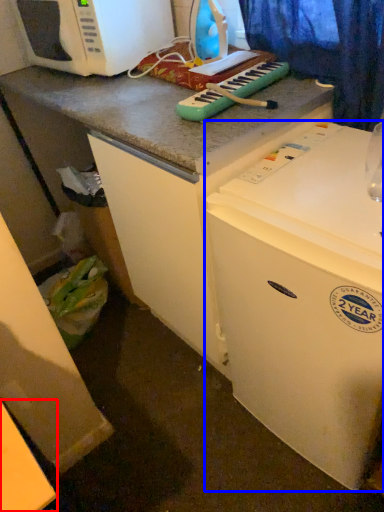
Question: Which of the following is the closest to the observer, counter top (highlighted by a red box) or refrigerator (highlighted by a blue box)?

Choices:
 (A) counter top
 (B) refrigerator

Answer: (A)